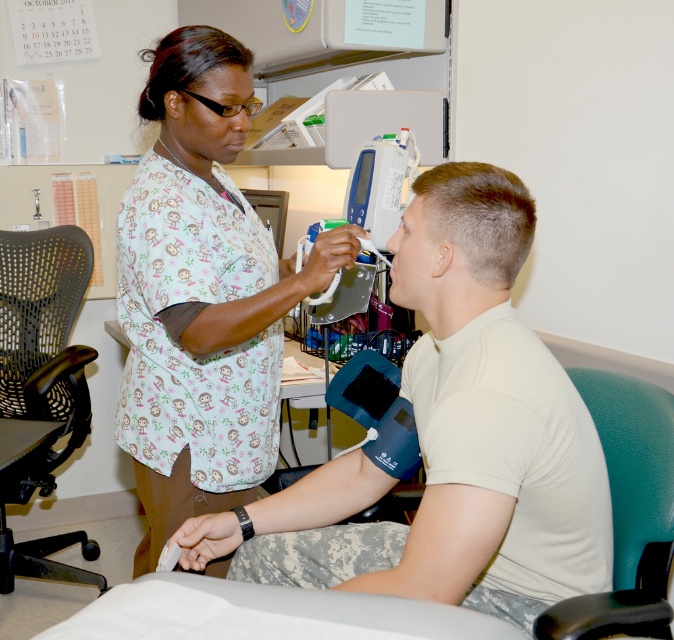
Between point (142, 422) and point (551, 625), which one is positioned in front?

Point (551, 625)

Between point (255, 234) and point (665, 392), which one is positioned behind?

The point (255, 234) is more distant.

Locate an element on the screen. The height and width of the screenshot is (640, 674). white printed scrubs at center is located at coordinates (202, 294).

This screenshot has width=674, height=640. In order to click on white printed scrubs at center in this screenshot , I will do `click(202, 294)`.

Does black mesh office chair at left have a lesser width compared to teal leather chair at right?

In fact, black mesh office chair at left might be wider than teal leather chair at right.

Is point (20, 289) farther from camera compared to point (561, 604)?

Yes.

Who is more distant from viewer, (44, 326) or (640, 467)?

The point (44, 326) is more distant.

Find the location of a particular element. This screenshot has height=640, width=674. black mesh office chair at left is located at coordinates (40, 387).

Consider the image. Between white printed scrubs at center and black mesh office chair at left, which one has less height?

white printed scrubs at center is shorter.

Can you confirm if white printed scrubs at center is positioned above black mesh office chair at left?

Indeed, white printed scrubs at center is positioned over black mesh office chair at left.

Between point (191, 228) and point (9, 237), which one is positioned behind?

The point (9, 237) is more distant.

You are a GUI agent. You are given a task and a screenshot of the screen. Output one action in this format:
    pyautogui.click(x=<x>, y=<y>)
    Task: Click on the white printed scrubs at center
    Image resolution: width=674 pixels, height=640 pixels.
    Given the screenshot: What is the action you would take?
    pyautogui.click(x=202, y=294)